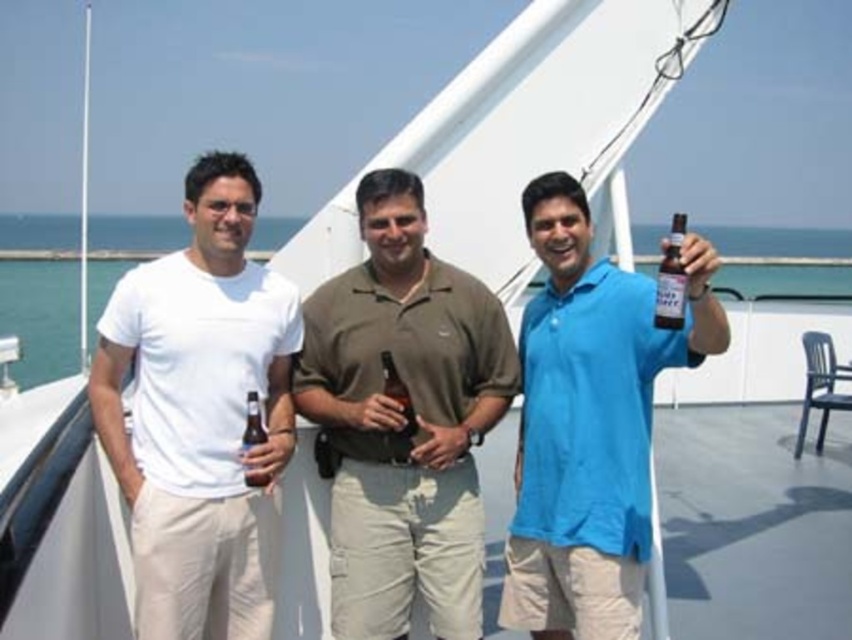
Is point (632, 394) closer to camera compared to point (655, 321)?

No, (632, 394) is further to viewer.

Can you confirm if blue matte shirt at center is positioned to the right of translucent glass bottle at upper right?

In fact, blue matte shirt at center is to the left of translucent glass bottle at upper right.

Where is `blue matte shirt at center`? blue matte shirt at center is located at coordinates (590, 422).

Can you confirm if translucent glass bottle at upper right is positioned to the right of brown glass bottle at center?

Correct, you'll find translucent glass bottle at upper right to the right of brown glass bottle at center.

Is translucent glass bottle at upper right above brown glass bottle at center?

Yes, translucent glass bottle at upper right is above brown glass bottle at center.

The image size is (852, 640). Find the location of `translucent glass bottle at upper right`. translucent glass bottle at upper right is located at coordinates (671, 280).

The image size is (852, 640). I want to click on matte brown shirt at center, so click(x=403, y=420).

Which of these two, matte brown shirt at center or matte brown bottle at center, stands shorter?

Standing shorter between the two is matte brown bottle at center.

Find the location of `matte brown shirt at center`. matte brown shirt at center is located at coordinates (403, 420).